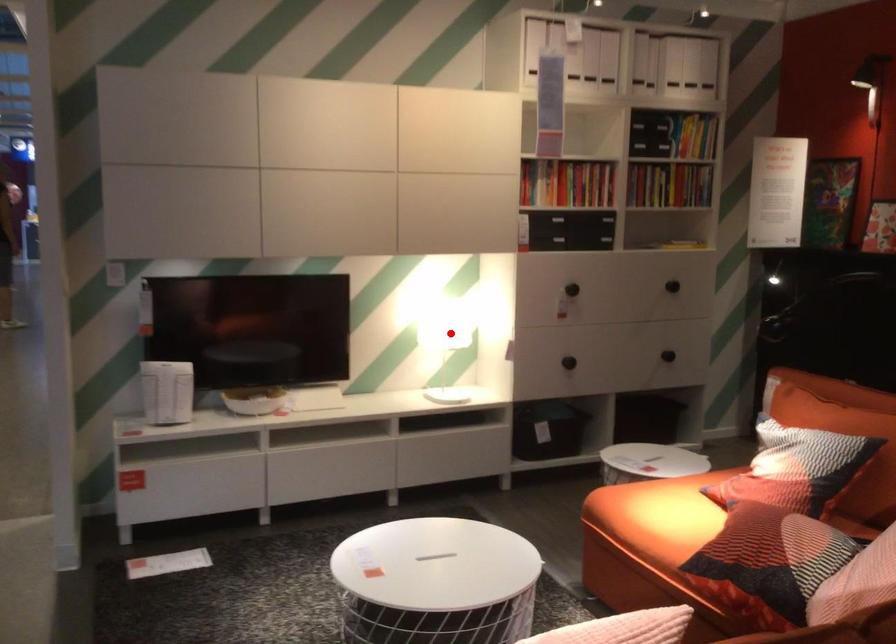
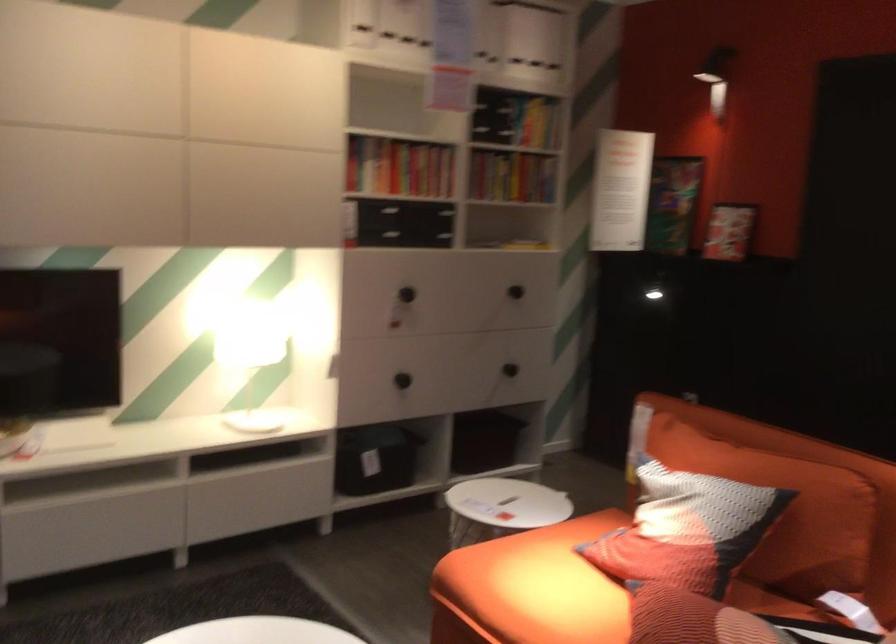
Question: A red point is marked in image1. In image2, is the corresponding 3D point closer to the camera or farther? Reply with the corresponding letter.

Choices:
 (A) The corresponding 3D point is closer.
 (B) The corresponding 3D point is farther.

Answer: (A)